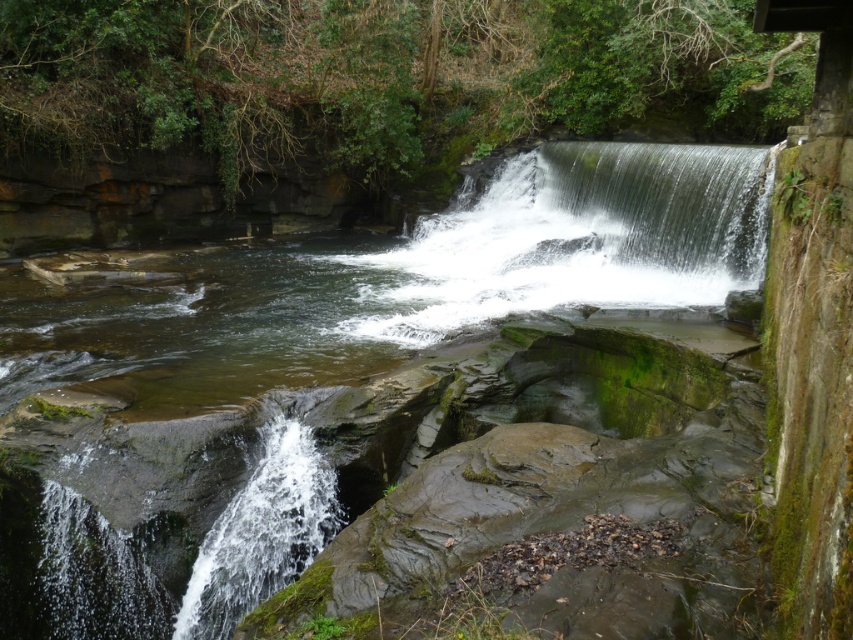
You are standing at the origin point of the image, which is the bottom left corner. You want to locate the clear water at center. In what direction should you move relative to the origin point to reach it?

The clear water at center is located at point 0.439 on the x axis and 0.472 on the y axis. Since the origin is at the bottom left corner, moving to the right along the x axis and upwards along the y axis will reach the clear water at center.

You are a photographer planning to capture the waterfall scene. You want to ensure both the clear water at center and the green mossy rock at center are visible in your shot. Which object should you focus on to include both in the frame, considering their widths?

The clear water at center is wider than the green mossy rock at center, so focusing on the clear water at center would allow both objects to fit within the frame since it occupies more space.